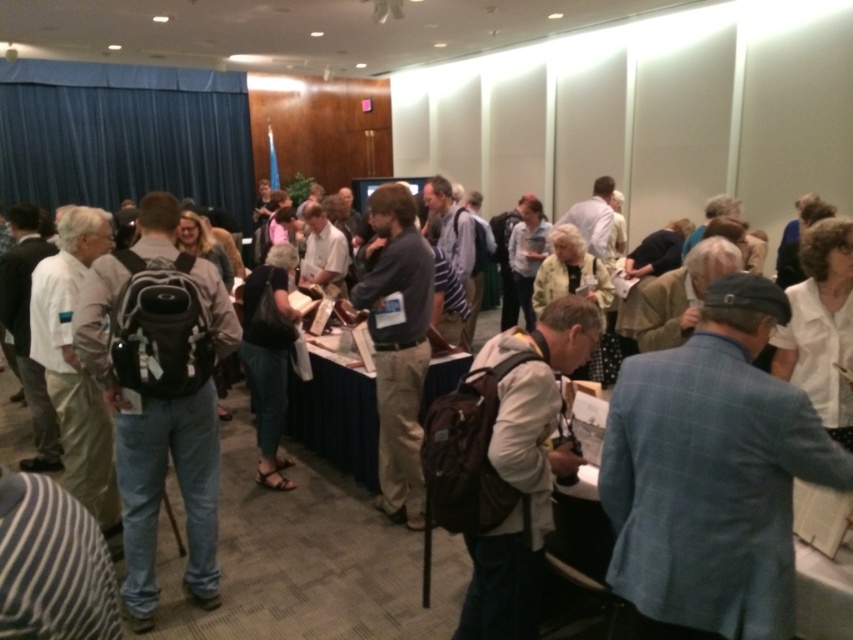
Looking at this image, you are organizing a photo shoot and need to know which clothing item takes up more horizontal space. You see the blue plaid blazer at center and the dark gray sweater at center. Which one is wider?

The blue plaid blazer at center is wider than the dark gray sweater at center according to the description.

You are a photographer who needs to capture a clear image of the white cotton shirt at center. Your camera has a minimum focusing distance of 5 feet. Can you take the photo without moving either the camera or the shirt?

The white cotton shirt at center and camera are 5.67 feet apart, which is greater than the camera minimum focusing distance of 5 feet. Therefore, you can take the photo without moving either the camera or the shirt.

You are attending a conference and notice two attendees wearing a blue plaid blazer at center and a dark gray sweater at center. Which clothing item is positioned more to the right in the scene?

The blue plaid blazer at center is positioned to the right of the dark gray sweater at center, so the blue plaid blazer at center is more to the right.